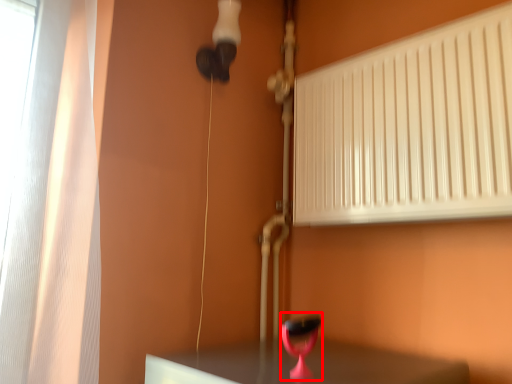
Question: From the image, what is the correct spatial relationship of table lamp (annotated by the red box) in relation to radiator?

Choices:
 (A) right
 (B) left

Answer: (B)